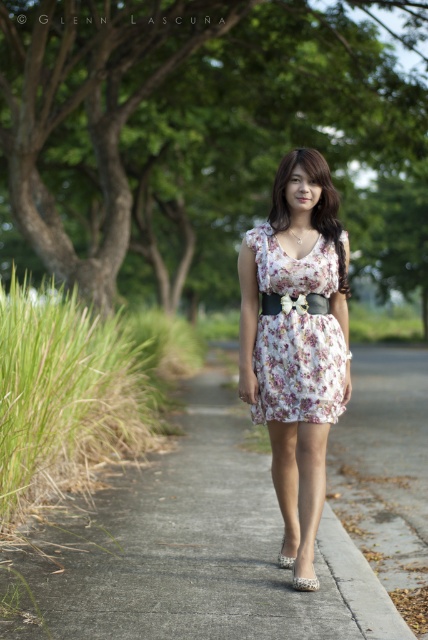
Question: Which of the following is the closest to the observer?

Choices:
 (A) pearl-like fabric sandal at lower center
 (B) leopard print fabric sandal at center

Answer: (B)

Question: From the image, what is the correct spatial relationship of floral cotton dress at center in relation to leopard print fabric sandal at center?

Choices:
 (A) above
 (B) below

Answer: (A)

Question: Is gray concrete pavement at center wider than pearl-like fabric sandal at lower center?

Choices:
 (A) yes
 (B) no

Answer: (A)

Question: Which point is farther to the camera?

Choices:
 (A) (308, 385)
 (B) (288, 557)

Answer: (B)

Question: Among these objects, which one is nearest to the camera?

Choices:
 (A) leopard print fabric sandal at center
 (B) gray concrete pavement at center

Answer: (B)

Question: Is leopard print fabric sandal at center smaller than pearl-like fabric sandal at lower center?

Choices:
 (A) no
 (B) yes

Answer: (B)